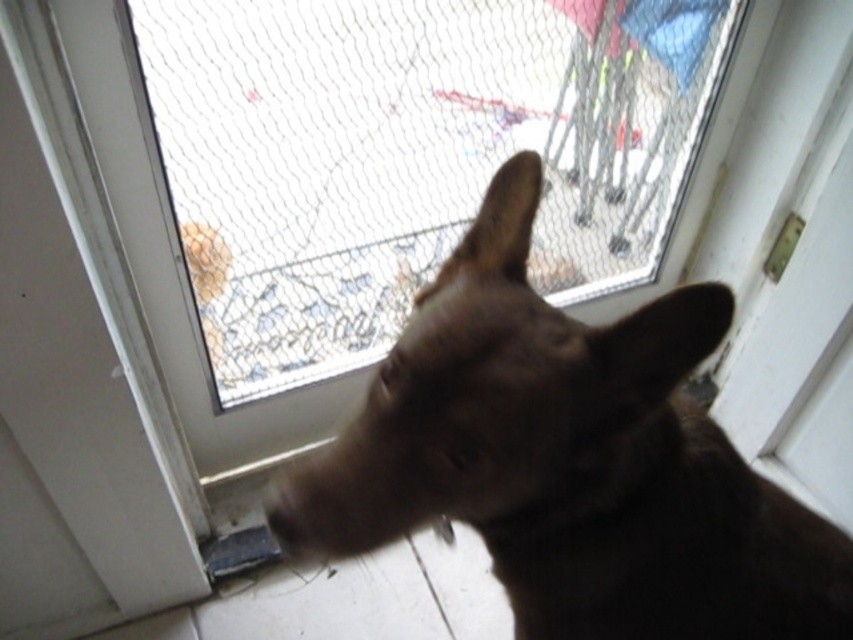
Question: Which point is closer to the camera?

Choices:
 (A) (486, 45)
 (B) (589, 413)

Answer: (B)

Question: Which point is farther from the camera taking this photo?

Choices:
 (A) (508, 186)
 (B) (438, 76)

Answer: (B)

Question: Does transparent mesh at upper center have a smaller size compared to brown fur dog at center?

Choices:
 (A) yes
 (B) no

Answer: (B)

Question: Which object is closer to the camera taking this photo?

Choices:
 (A) brown fur dog at center
 (B) transparent mesh at upper center

Answer: (A)

Question: Is transparent mesh at upper center wider than brown fur dog at center?

Choices:
 (A) no
 (B) yes

Answer: (B)

Question: Can you confirm if transparent mesh at upper center is bigger than brown fur dog at center?

Choices:
 (A) no
 (B) yes

Answer: (B)